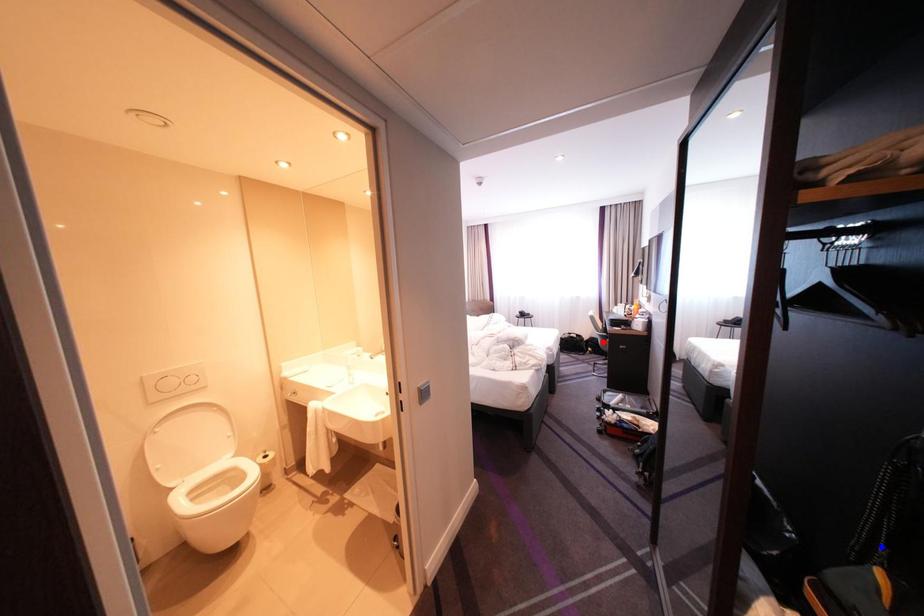
Question: Two points are marked on the image. Which point is closer to the camera?

Choices:
 (A) Blue point is closer.
 (B) Red point is closer.

Answer: (A)